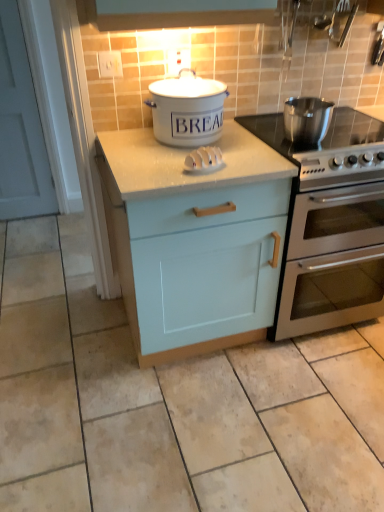
The image size is (384, 512). I want to click on free spot in front of white plastic knife block at center, so tap(198, 179).